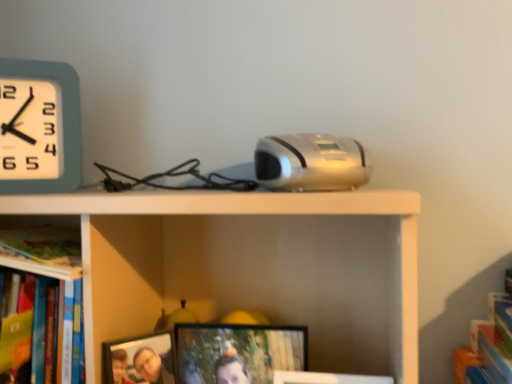
Question: Does silver metallic projector at center have a smaller size compared to matte black picture frame at center, the 2th picture frame viewed from the left?

Choices:
 (A) no
 (B) yes

Answer: (A)

Question: Is the position of silver metallic projector at center more distant than that of matte black picture frame at center, the 2th picture frame viewed from the left?

Choices:
 (A) yes
 (B) no

Answer: (B)

Question: Does silver metallic projector at center appear on the right side of matte black picture frame at center, which ranks as the first picture frame in right-to-left order?

Choices:
 (A) no
 (B) yes

Answer: (B)

Question: Can we say silver metallic projector at center lies outside matte black picture frame at center, the 2th picture frame viewed from the left?

Choices:
 (A) yes
 (B) no

Answer: (A)

Question: Does silver metallic projector at center lie in front of matte black picture frame at center, the 2th picture frame viewed from the left?

Choices:
 (A) yes
 (B) no

Answer: (A)

Question: Is silver metallic projector at center at the left side of matte black picture frame at center, which ranks as the first picture frame in right-to-left order?

Choices:
 (A) yes
 (B) no

Answer: (B)

Question: From a real-world perspective, is wooden photo frame at lower center, which is the 2th picture frame in right-to-left order, located beneath silver metallic projector at center?

Choices:
 (A) no
 (B) yes

Answer: (B)

Question: Does wooden photo frame at lower center, which appears as the 1th picture frame when viewed from the left, have a greater height compared to silver metallic projector at center?

Choices:
 (A) yes
 (B) no

Answer: (A)

Question: Is wooden photo frame at lower center, which is the 2th picture frame in right-to-left order, shorter than silver metallic projector at center?

Choices:
 (A) yes
 (B) no

Answer: (B)

Question: Can you confirm if wooden photo frame at lower center, which is the 2th picture frame in right-to-left order, is wider than silver metallic projector at center?

Choices:
 (A) yes
 (B) no

Answer: (B)

Question: Can you confirm if wooden photo frame at lower center, which is the 2th picture frame in right-to-left order, is thinner than silver metallic projector at center?

Choices:
 (A) yes
 (B) no

Answer: (A)

Question: Is wooden photo frame at lower center, which is the 2th picture frame in right-to-left order, facing away from silver metallic projector at center?

Choices:
 (A) yes
 (B) no

Answer: (B)

Question: From the image's perspective, is teal plastic wall clock at upper left beneath silver metallic projector at center?

Choices:
 (A) no
 (B) yes

Answer: (A)